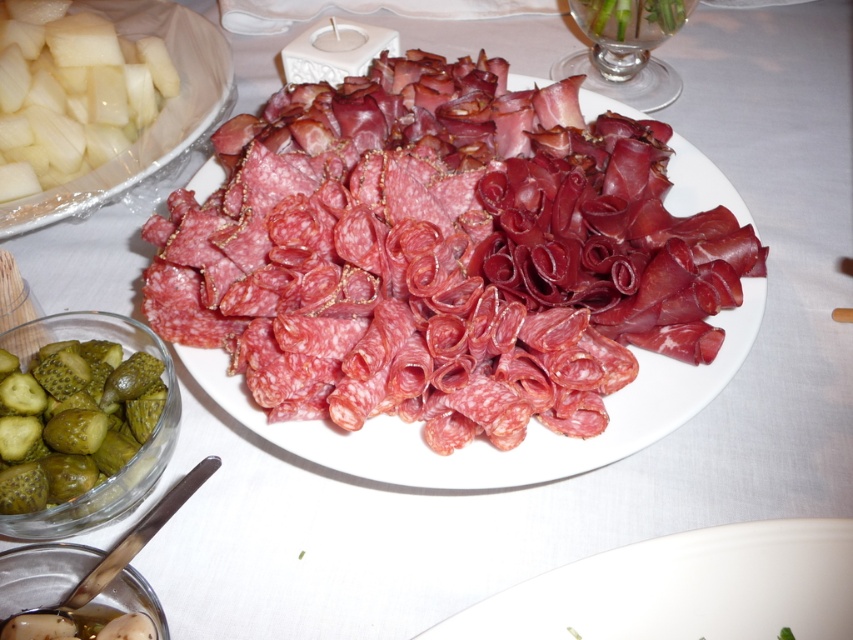
Does white porcelain plate at lower center appear on the right side of green pickled cucumber at lower left?

Yes, white porcelain plate at lower center is to the right of green pickled cucumber at lower left.

Between white porcelain plate at lower center and green pickled cucumber at lower left, which one has more height?

With more height is green pickled cucumber at lower left.

Which is behind, point (596, 568) or point (123, 433)?

Point (123, 433)

The height and width of the screenshot is (640, 853). In order to click on white porcelain plate at lower center in this screenshot , I will do `click(683, 588)`.

Is point (381, 196) more distant than point (630, 33)?

No, it is not.

Which is below, pinkish-red cured meat at center or green pickled cucumber at upper right?

Positioned lower is pinkish-red cured meat at center.

Between point (300, 284) and point (587, 19), which one is positioned behind?

Positioned behind is point (587, 19).

I want to click on pinkish-red cured meat at center, so click(463, 310).

Who is shorter, white porcelain plate at lower center or green pickled cucumber at upper right?

With less height is green pickled cucumber at upper right.

Does white porcelain plate at lower center appear on the left side of green pickled cucumber at upper right?

A: Correct, you'll find white porcelain plate at lower center to the left of green pickled cucumber at upper right.

Find the location of a particular element. white porcelain plate at lower center is located at coordinates (683, 588).